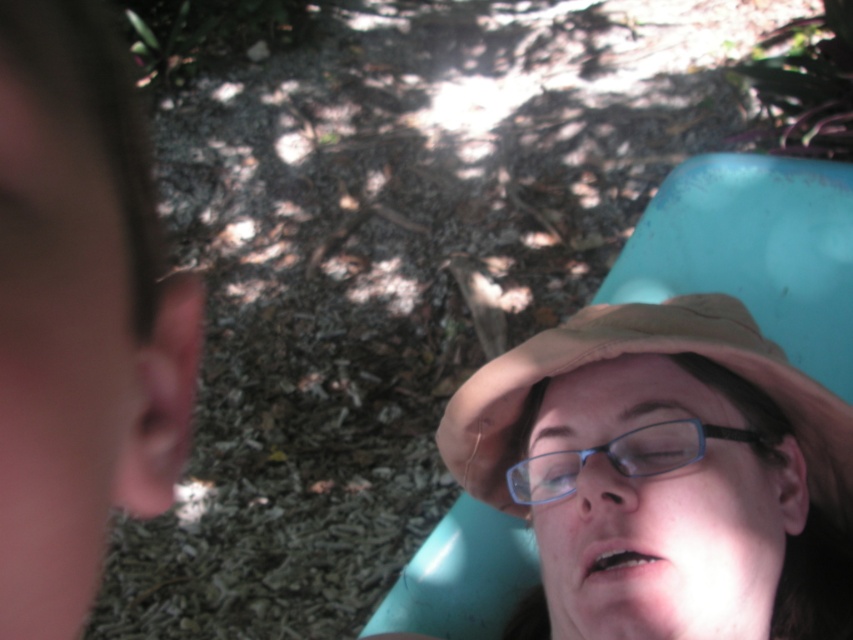
Question: Does tan fabric hat at upper center appear over blue plastic glasses at center?

Choices:
 (A) yes
 (B) no

Answer: (A)

Question: Which point is farther to the camera?

Choices:
 (A) (691, 456)
 (B) (78, 365)

Answer: (A)

Question: Which object appears farthest from the camera in this image?

Choices:
 (A) blue plastic glasses at center
 (B) blurred skin ear at left

Answer: (A)

Question: Can you confirm if tan fabric hat at upper center is positioned below blue plastic glasses at center?

Choices:
 (A) yes
 (B) no

Answer: (B)

Question: Can you confirm if tan fabric hat at upper center is wider than blue plastic glasses at center?

Choices:
 (A) yes
 (B) no

Answer: (A)

Question: Among these objects, which one is nearest to the camera?

Choices:
 (A) blue plastic glasses at center
 (B) blurred skin ear at left

Answer: (B)